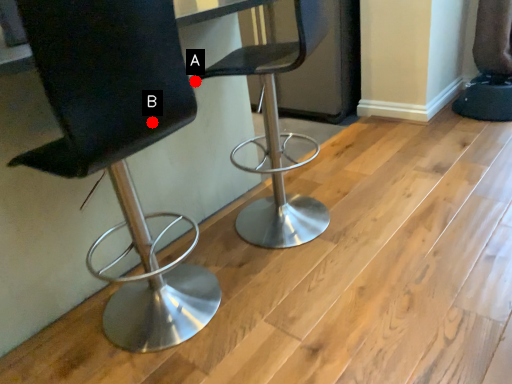
Question: Two points are circled on the image, labeled by A and B beside each circle. Which point is farther from the camera taking this photo?

Choices:
 (A) A is further
 (B) B is further

Answer: (A)